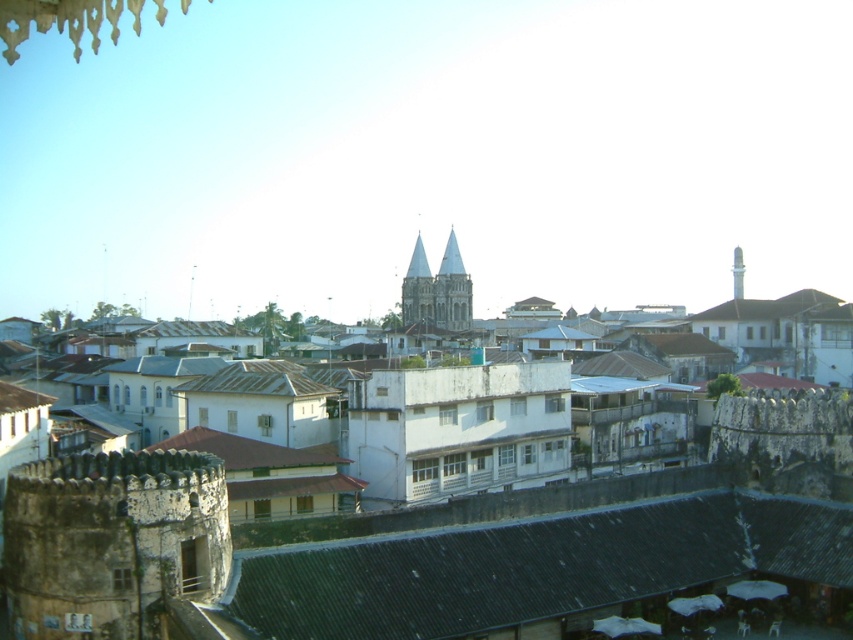
Question: Can you confirm if light brown stone tower at center is positioned below white stone spire at upper center?

Choices:
 (A) no
 (B) yes

Answer: (B)

Question: Which is farther from the white stone spire at upper center?

Choices:
 (A) dark gray corrugated metal roof at center
 (B) white corrugated metal roof at center

Answer: (A)

Question: Which object is farther from the camera taking this photo?

Choices:
 (A) white matte building at center
 (B) smooth stone tower at center
 (C) brown corrugated metal roof at center

Answer: (B)

Question: Can you confirm if white corrugated metal roof at center is smaller than smooth stone tower at center?

Choices:
 (A) yes
 (B) no

Answer: (A)

Question: Can you confirm if light brown stone tower at center is wider than smooth stone tower at center?

Choices:
 (A) yes
 (B) no

Answer: (A)

Question: Which point is closer to the camera taking this photo?

Choices:
 (A) (224, 387)
 (B) (572, 538)
 (C) (688, 589)
 (D) (416, 300)

Answer: (C)